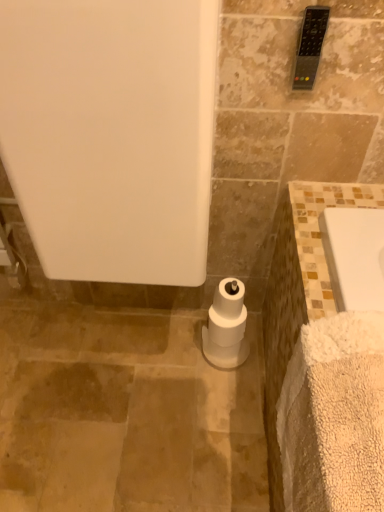
Question: Would you say white fluffy bath towel at lower right is outside white matte bathtub at center?

Choices:
 (A) yes
 (B) no

Answer: (A)

Question: Does white fluffy bath towel at lower right come behind white matte bathtub at center?

Choices:
 (A) yes
 (B) no

Answer: (B)

Question: Is white fluffy bath towel at lower right to the right of white matte bathtub at center from the viewer's perspective?

Choices:
 (A) yes
 (B) no

Answer: (A)

Question: Considering the relative positions of white fluffy bath towel at lower right and white matte bathtub at center in the image provided, is white fluffy bath towel at lower right to the left of white matte bathtub at center from the viewer's perspective?

Choices:
 (A) no
 (B) yes

Answer: (A)

Question: Is white matte bathtub at center at the back of white fluffy bath towel at lower right?

Choices:
 (A) yes
 (B) no

Answer: (B)

Question: Does white fluffy bath towel at lower right have a lesser height compared to white matte bathtub at center?

Choices:
 (A) no
 (B) yes

Answer: (B)

Question: Would you say white fluffy bath towel at lower right is part of white matte bathtub at center's contents?

Choices:
 (A) yes
 (B) no

Answer: (B)

Question: Is white matte bathtub at center outside white fluffy bath towel at lower right?

Choices:
 (A) yes
 (B) no

Answer: (A)

Question: Is white matte bathtub at center next to white fluffy bath towel at lower right?

Choices:
 (A) yes
 (B) no

Answer: (B)

Question: Can you confirm if white matte bathtub at center is smaller than white fluffy bath towel at lower right?

Choices:
 (A) yes
 (B) no

Answer: (B)

Question: Is white matte bathtub at center taller than white fluffy bath towel at lower right?

Choices:
 (A) no
 (B) yes

Answer: (B)

Question: From the image's perspective, is white matte bathtub at center over white fluffy bath towel at lower right?

Choices:
 (A) yes
 (B) no

Answer: (A)

Question: Is white fluffy bath towel at lower right surrounding white matte toilet paper at center?

Choices:
 (A) no
 (B) yes

Answer: (A)